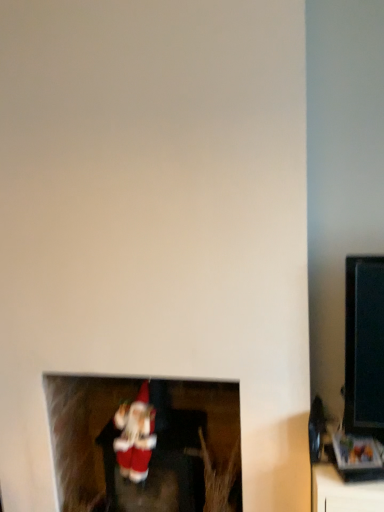
Question: Is red plush santa at lower center wider or thinner than velvet santa at lower center?

Choices:
 (A) thin
 (B) wide

Answer: (A)

Question: From the image's perspective, is red plush santa at lower center positioned above or below velvet santa at lower center?

Choices:
 (A) above
 (B) below

Answer: (A)

Question: Considering the relative positions of red plush santa at lower center and velvet santa at lower center in the image provided, is red plush santa at lower center to the left or to the right of velvet santa at lower center?

Choices:
 (A) left
 (B) right

Answer: (A)

Question: From a real-world perspective, is velvet santa at lower center positioned above or below red plush santa at lower center?

Choices:
 (A) below
 (B) above

Answer: (A)

Question: Is velvet santa at lower center in front of or behind red plush santa at lower center in the image?

Choices:
 (A) front
 (B) behind

Answer: (B)

Question: From the image's perspective, is velvet santa at lower center positioned above or below red plush santa at lower center?

Choices:
 (A) below
 (B) above

Answer: (A)

Question: In terms of height, does velvet santa at lower center look taller or shorter compared to red plush santa at lower center?

Choices:
 (A) tall
 (B) short

Answer: (A)